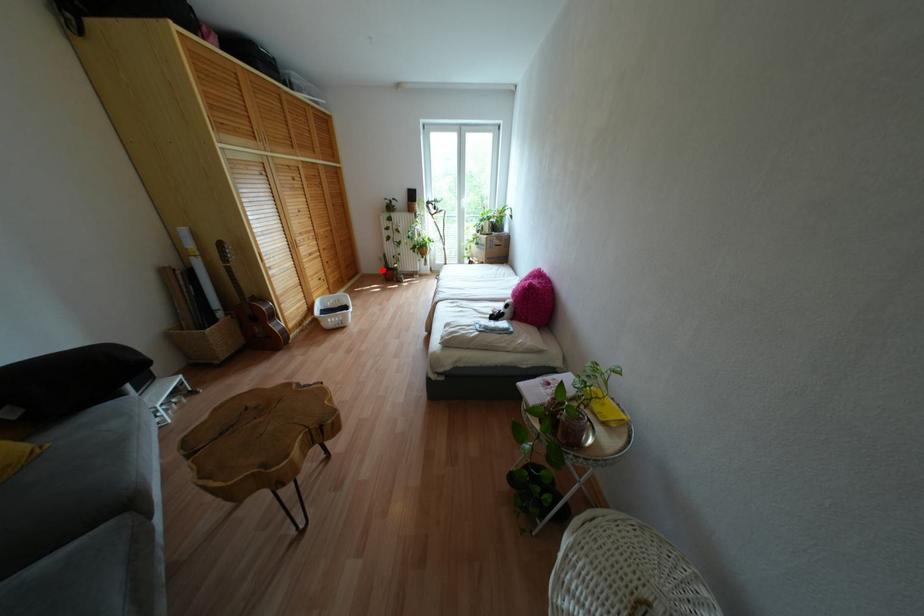
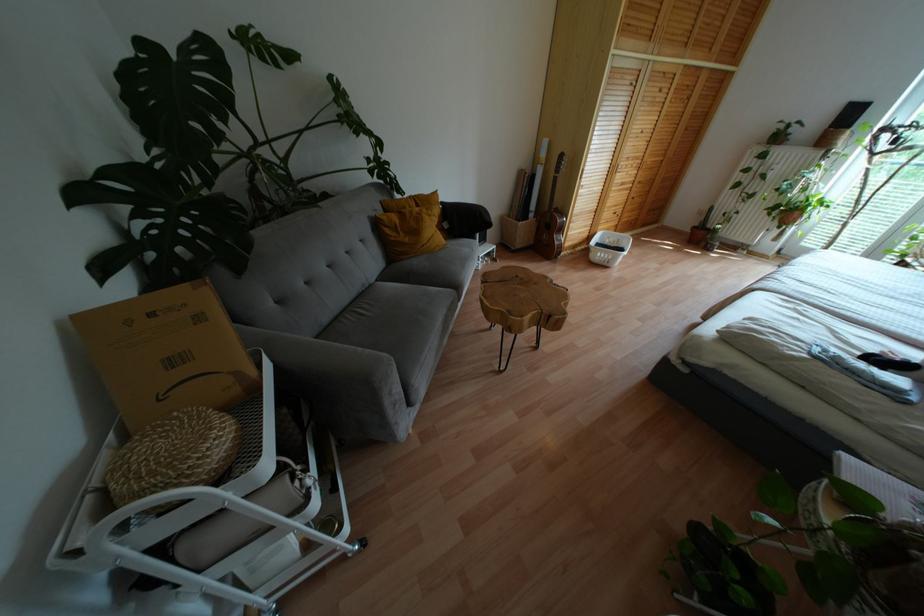
Question: A red point is marked in image1. In image2, is the corresponding 3D point closer to the camera or farther? Reply with the corresponding letter.

Choices:
 (A) The corresponding 3D point is closer.
 (B) The corresponding 3D point is farther.

Answer: (A)